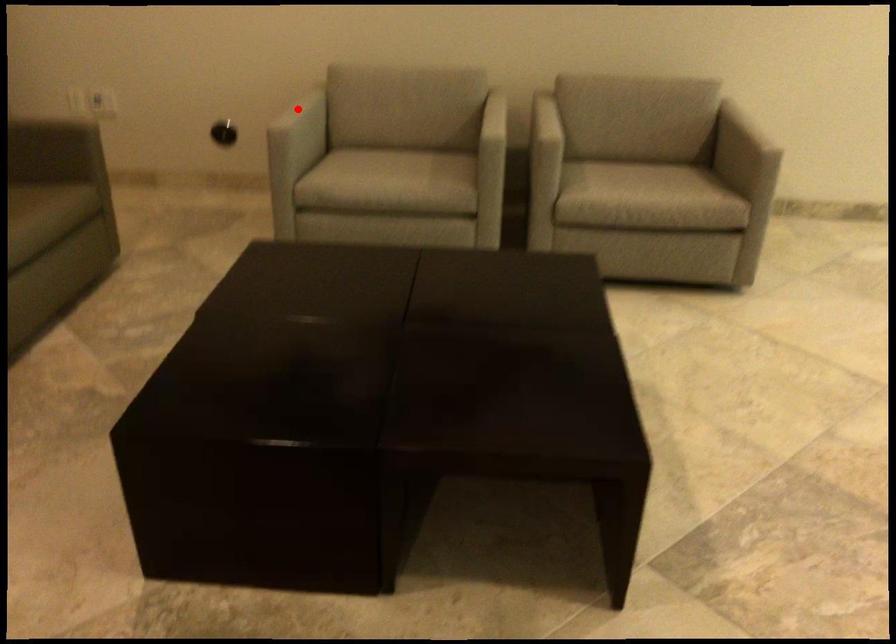
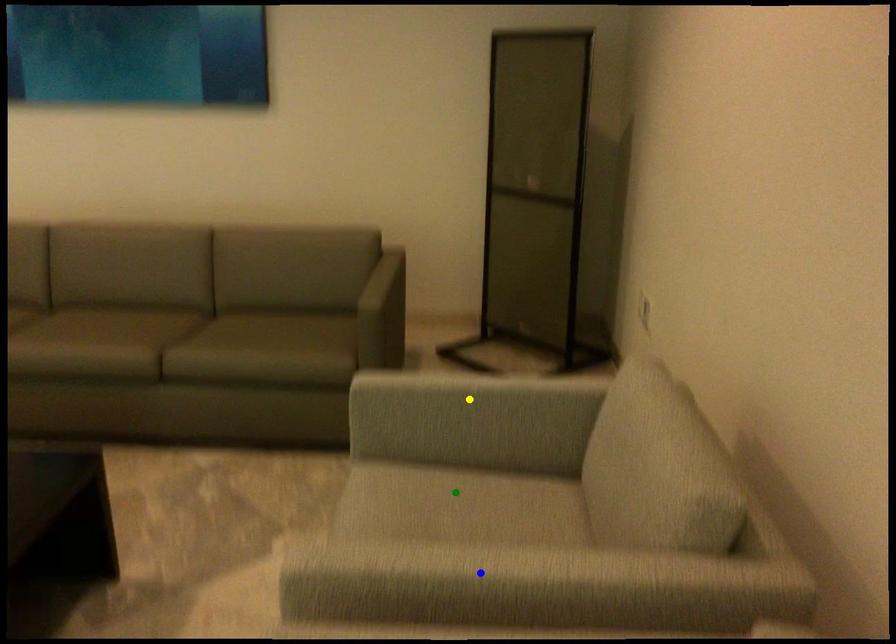
Question: I am providing you with two images of the same scene from different viewpoints. A red point is marked on the first image. You are given multiple points on the second image. In image 2, which mark is for the same physical point as the one in image 1?

Choices:
 (A) blue point
 (B) green point
 (C) yellow point

Answer: (C)